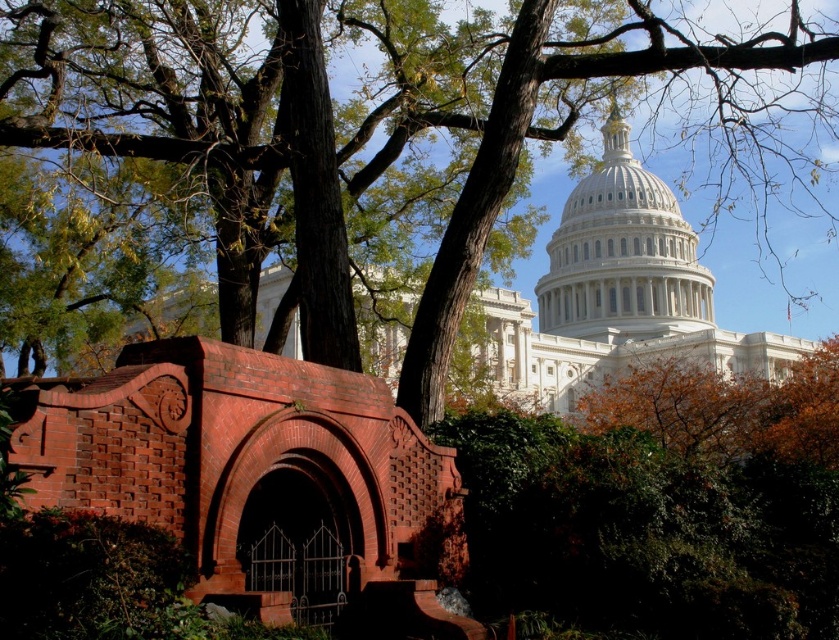
You are a tourist standing in front of the red brick structure with an arched entrance. You want to take a photo of the white marble dome at center without any obstructions. Is the green leafy tree at upper center blocking your view of the dome?

The green leafy tree at upper center is positioned on the left side of the white marble dome at center, so it will not block your view of the dome from the front of the red brick structure with an arched entrance.

You are a tourist standing in front of the red brick structure with an arched entrance. You want to take a photo of the white marble dome at center without any obstructions. Is there a way to position yourself so that the green leafy tree at upper center does not block your view?

The green leafy tree at upper center is above the white marble dome at center, so positioning yourself lower or moving to the side might allow you to capture the dome without the tree obstructing the view.

Based on the photo, you are standing in front of the United States Capitol Building and notice a green leafy tree at upper center and a white marble dome at center. Which object is nearer to you?

The green leafy tree at upper center is closer to the viewer than the white marble dome at center.